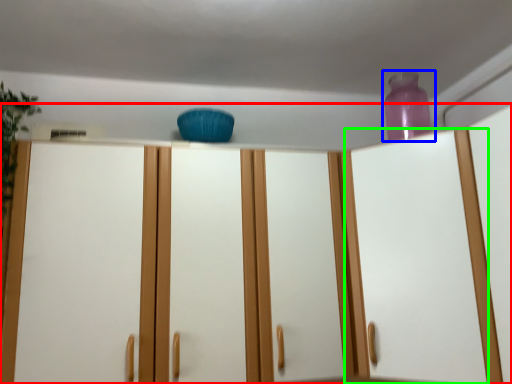
Question: Based on their relative distances, which object is nearer to cupboard (highlighted by a red box)? Choose from bottle (highlighted by a blue box) and glass door (highlighted by a green box).

Choices:
 (A) bottle
 (B) glass door

Answer: (B)